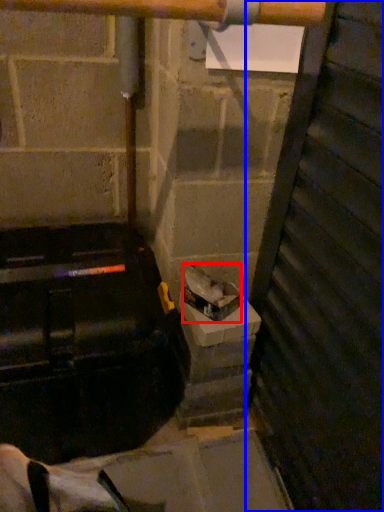
Question: Among these objects, which one is nearest to the camera, garbage (highlighted by a red box) or door (highlighted by a blue box)?

Choices:
 (A) garbage
 (B) door

Answer: (B)